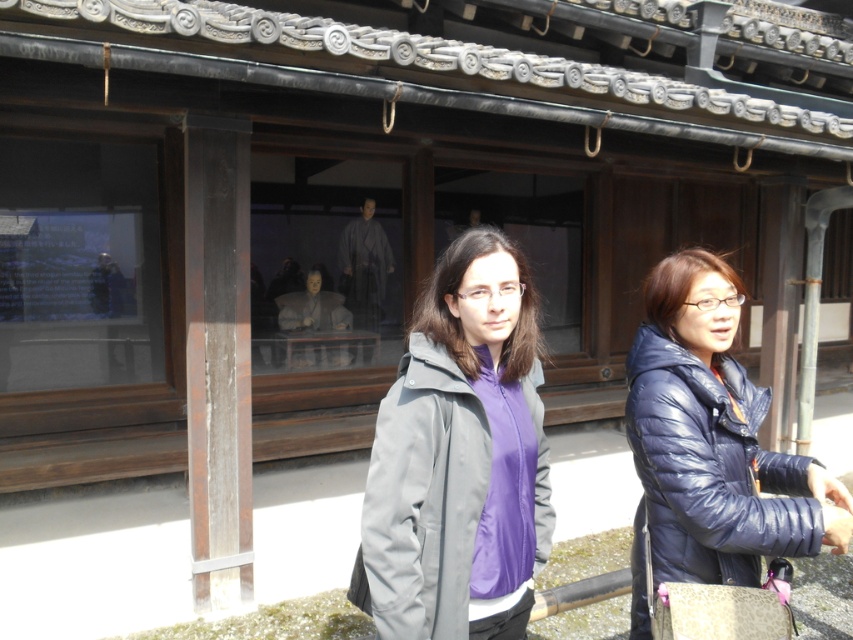
Can you confirm if matte gray jacket at center is thinner than glossy blue jacket at right?

Correct, matte gray jacket at center's width is less than glossy blue jacket at right's.

Locate an element on the screen. The width and height of the screenshot is (853, 640). matte gray jacket at center is located at coordinates (459, 458).

Is point (375, 541) positioned after point (759, 401)?

No, it is in front of (759, 401).

This screenshot has height=640, width=853. What are the coordinates of `matte gray jacket at center` in the screenshot? It's located at point(459,458).